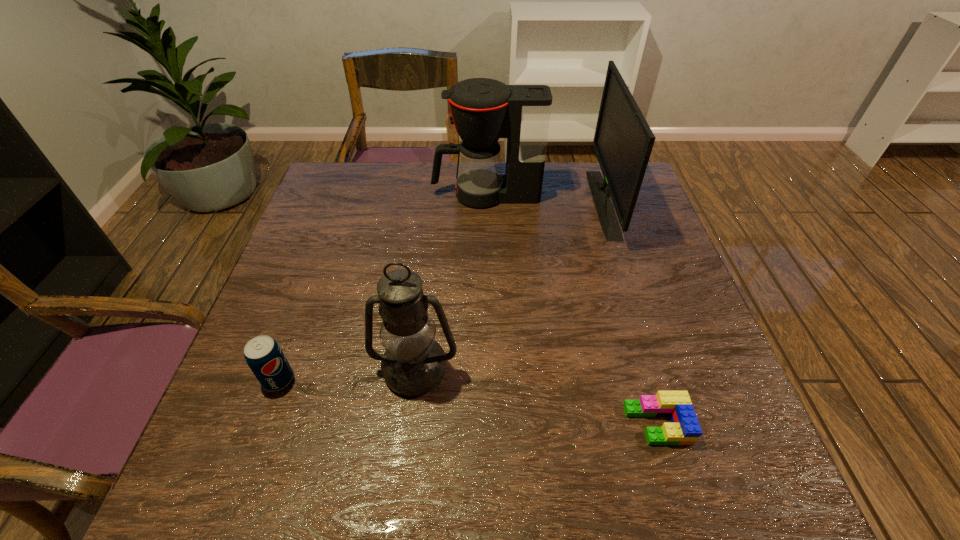
I want to click on free point located pour from the carafe of the coffee maker, so click(331, 195).

Find the location of a particular element. This screenshot has width=960, height=540. vacant region located pour from the carafe of the coffee maker is located at coordinates (412, 195).

This screenshot has width=960, height=540. In order to click on vacant region located pour from the carafe of the coffee maker in this screenshot , I will do `click(378, 195)`.

This screenshot has height=540, width=960. Find the location of `vacant space located 0.250m on the back of the oil lamp`. vacant space located 0.250m on the back of the oil lamp is located at coordinates (428, 261).

Image resolution: width=960 pixels, height=540 pixels. In order to click on vacant space situated 0.370m on the back of the leftmost object in this screenshot , I will do `click(326, 245)`.

Locate an element on the screen. vacant space situated on the left of the Lego is located at coordinates (546, 424).

The image size is (960, 540). I want to click on monitor that is positioned at the far edge, so click(x=623, y=141).

Identify the location of coffee maker that is at the far edge. This screenshot has width=960, height=540. (483, 110).

Where is `object that is positioned at the left edge`? object that is positioned at the left edge is located at coordinates coord(264,356).

I want to click on monitor that is positioned at the right edge, so click(623, 141).